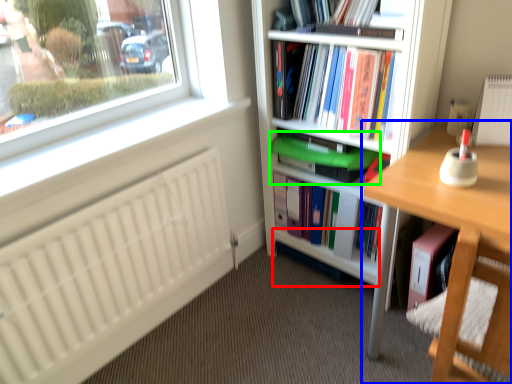
Question: Estimate the real-world distances between objects in this image. Which object is farther from shelf (highlighted by a red box), desk (highlighted by a blue box) or book (highlighted by a green box)?

Choices:
 (A) desk
 (B) book

Answer: (A)